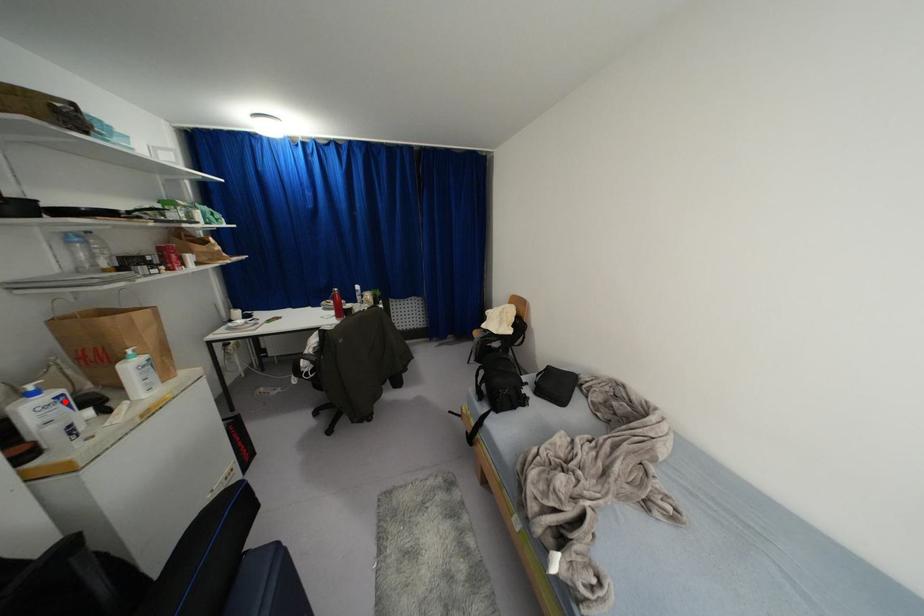
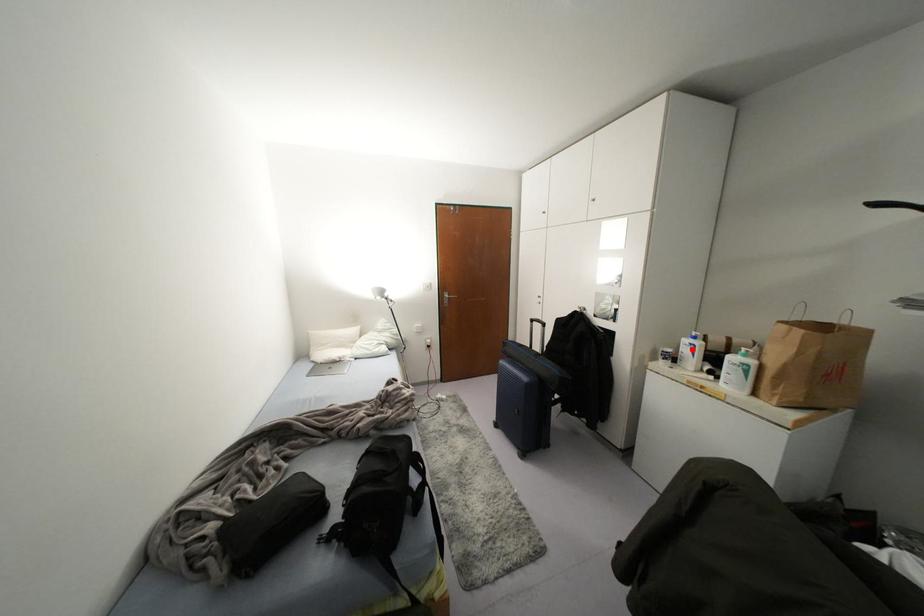
I am providing you with two images of the same scene from different viewpoints. A red point is marked on the first image and another point is marked on the second image. Does the point marked in image1 correspond to the same location as the one in image2?

Yes